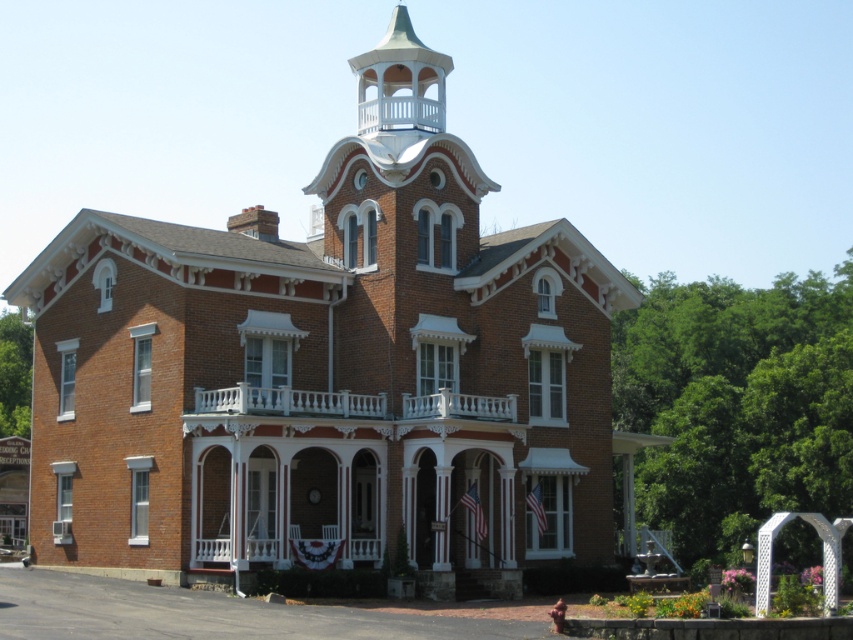
You are an architect evaluating the structural integrity of the building. You notice the white painted wood spire at upper center and the white carved wood porch at center. Which of these two elements is located directly above the other?

The white painted wood spire at upper center is positioned over the white carved wood porch at center, meaning the spire is directly above the porch.

You are an architect examining the building. You notice two porches on the structure. Which one is taller, the white carved wood porch at center or the white painted wood porch at lower center?

The white carved wood porch at center is much taller than the white painted wood porch at lower center.